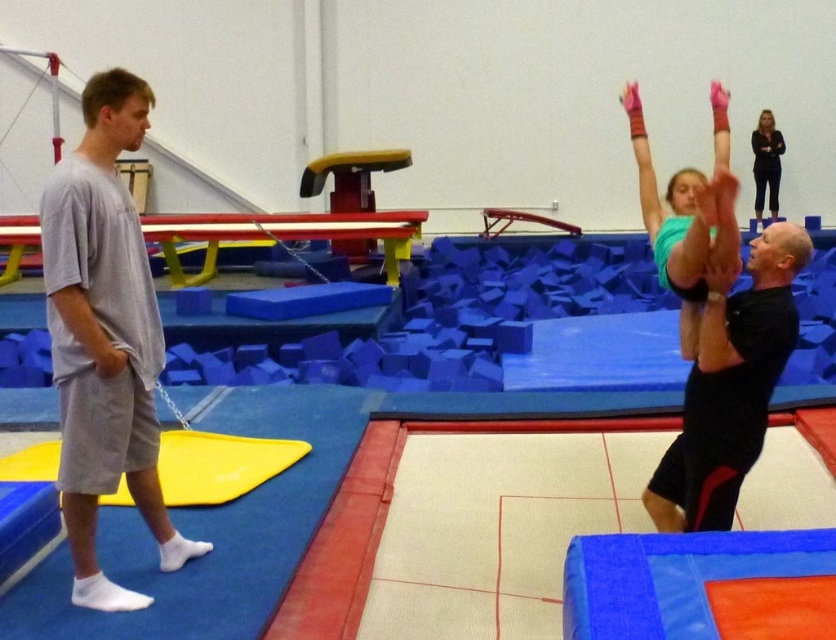
Is gray cotton shorts at left behind black matte shirt at upper right?

Yes, it is behind black matte shirt at upper right.

Is gray cotton shorts at left smaller than black matte shirt at upper right?

No, gray cotton shorts at left is not smaller than black matte shirt at upper right.

The image size is (836, 640). In order to click on gray cotton shorts at left in this screenshot , I will do `click(104, 337)`.

Which of these two, gray cotton shorts at left or gray cotton shirt at left, stands shorter?

gray cotton shirt at left

This screenshot has height=640, width=836. What do you see at coordinates (104, 337) in the screenshot?
I see `gray cotton shorts at left` at bounding box center [104, 337].

Find the location of a particular element. The width and height of the screenshot is (836, 640). gray cotton shorts at left is located at coordinates (104, 337).

Can you confirm if gray cotton shirt at left is positioned above dark blue jeans at upper right?

No, gray cotton shirt at left is not above dark blue jeans at upper right.

Is point (70, 285) farther from camera compared to point (763, 192)?

No, it is in front of (763, 192).

Locate an element on the screen. gray cotton shirt at left is located at coordinates (88, 330).